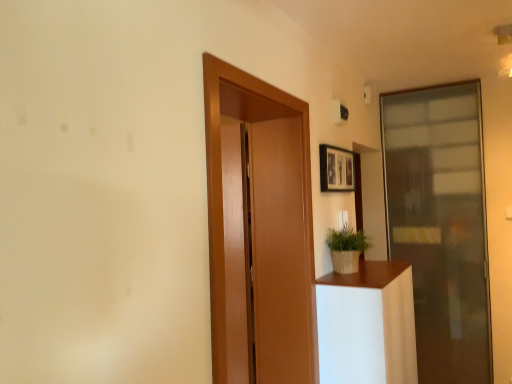
Question: Is green woven basket at right thinner than transparent glass door at right, which is the second door from front to back?

Choices:
 (A) yes
 (B) no

Answer: (B)

Question: Is green woven basket at right to the left of transparent glass door at right, the 2th door positioned from the left, from the viewer's perspective?

Choices:
 (A) no
 (B) yes

Answer: (B)

Question: Does green woven basket at right have a greater height compared to transparent glass door at right, which is the first door from back to front?

Choices:
 (A) yes
 (B) no

Answer: (B)

Question: From a real-world perspective, is green woven basket at right located beneath transparent glass door at right, the 2th door positioned from the left?

Choices:
 (A) no
 (B) yes

Answer: (A)

Question: Is green woven basket at right positioned with its back to transparent glass door at right, which is the first door from back to front?

Choices:
 (A) yes
 (B) no

Answer: (B)

Question: Is green woven basket at right facing towards transparent glass door at right, which is the second door from front to back?

Choices:
 (A) no
 (B) yes

Answer: (A)

Question: Is transparent glass door at right, the 2th door positioned from the left, thinner than wooden door at center, the second door from the back?

Choices:
 (A) no
 (B) yes

Answer: (B)

Question: From the image's perspective, is transparent glass door at right, which is the second door from front to back, on wooden door at center, which appears as the 1th door when viewed from the left?

Choices:
 (A) no
 (B) yes

Answer: (A)

Question: Is wooden door at center, which appears as the 1th door when viewed from the left, located within transparent glass door at right, the 2th door positioned from the left?

Choices:
 (A) yes
 (B) no

Answer: (B)

Question: Does transparent glass door at right, the 2th door positioned from the left, come in front of wooden door at center, which appears as the 1th door when viewed from the left?

Choices:
 (A) yes
 (B) no

Answer: (B)

Question: Is transparent glass door at right, which is the second door from front to back, wider than wooden door at center, the second door from the back?

Choices:
 (A) no
 (B) yes

Answer: (A)

Question: From the image's perspective, would you say transparent glass door at right, the 2th door positioned from the left, is shown under wooden door at center, which appears as the 1th door when viewed from the left?

Choices:
 (A) no
 (B) yes

Answer: (B)

Question: Is green woven basket at right wider than white matte plant pot at right?

Choices:
 (A) yes
 (B) no

Answer: (B)